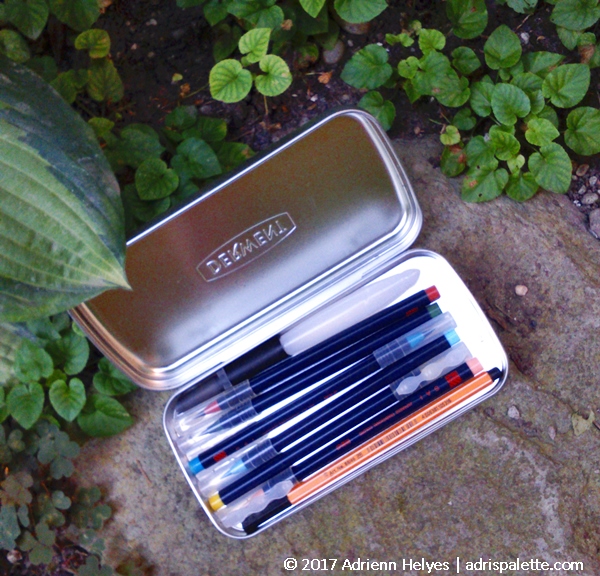
Identify the location of pens. (356, 381).